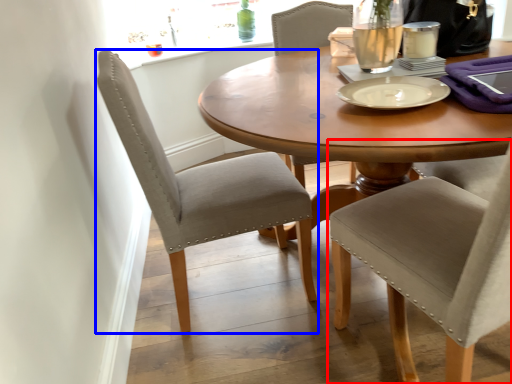
Question: Which point is further to the camera, chair (highlighted by a red box) or chair (highlighted by a blue box)?

Choices:
 (A) chair
 (B) chair

Answer: (B)